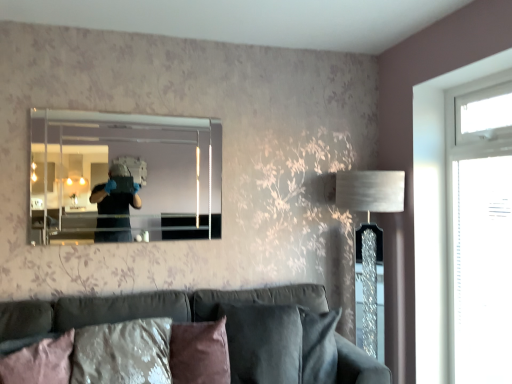
Question: Should I look upward or downward to see silver textured lampshade at right?

Choices:
 (A) up
 (B) down

Answer: (B)

Question: Should I look upward or downward to see clear glass mirror at upper center?

Choices:
 (A) up
 (B) down

Answer: (A)

Question: Is pink fabric pillow at lower left, acting as the second pillow starting from the right, looking in the opposite direction of transparent glass window at right?

Choices:
 (A) yes
 (B) no

Answer: (B)

Question: Can you confirm if pink fabric pillow at lower left, acting as the second pillow starting from the right, is wider than transparent glass window at right?

Choices:
 (A) yes
 (B) no

Answer: (A)

Question: From the image's perspective, is pink fabric pillow at lower left, acting as the second pillow starting from the right, on transparent glass window at right?

Choices:
 (A) no
 (B) yes

Answer: (A)

Question: Would you say pink fabric pillow at lower left, acting as the 1th pillow starting from the left, contains transparent glass window at right?

Choices:
 (A) no
 (B) yes

Answer: (A)

Question: From a real-world perspective, is pink fabric pillow at lower left, acting as the second pillow starting from the right, under transparent glass window at right?

Choices:
 (A) no
 (B) yes

Answer: (B)

Question: Can you confirm if pink fabric pillow at lower left, acting as the second pillow starting from the right, is positioned to the right of transparent glass window at right?

Choices:
 (A) no
 (B) yes

Answer: (A)

Question: Is clear glass mirror at upper center looking in the opposite direction of transparent glass window at right?

Choices:
 (A) no
 (B) yes

Answer: (A)

Question: From the image's perspective, is clear glass mirror at upper center under transparent glass window at right?

Choices:
 (A) yes
 (B) no

Answer: (B)

Question: Is clear glass mirror at upper center taller than transparent glass window at right?

Choices:
 (A) no
 (B) yes

Answer: (A)

Question: Is the depth of clear glass mirror at upper center greater than that of transparent glass window at right?

Choices:
 (A) no
 (B) yes

Answer: (B)

Question: Would you say clear glass mirror at upper center is outside transparent glass window at right?

Choices:
 (A) yes
 (B) no

Answer: (A)

Question: Would you say clear glass mirror at upper center contains transparent glass window at right?

Choices:
 (A) no
 (B) yes

Answer: (A)

Question: Is there a large distance between brown suede pillow at lower center, the first pillow viewed from the right, and velvet dark gray couch at lower center?

Choices:
 (A) yes
 (B) no

Answer: (B)